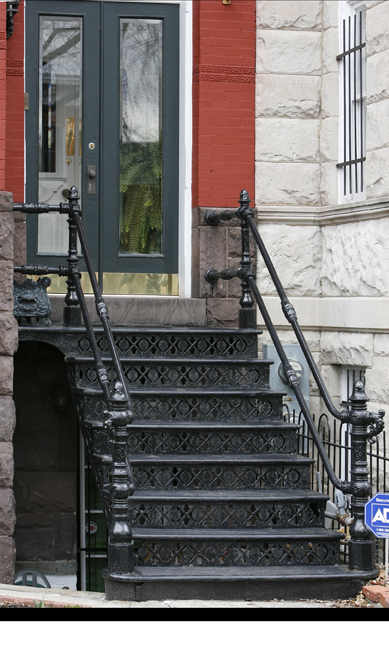
Find the location of `kick guards`. kick guards is located at coordinates (244, 548), (233, 523), (225, 475), (220, 441), (215, 418).